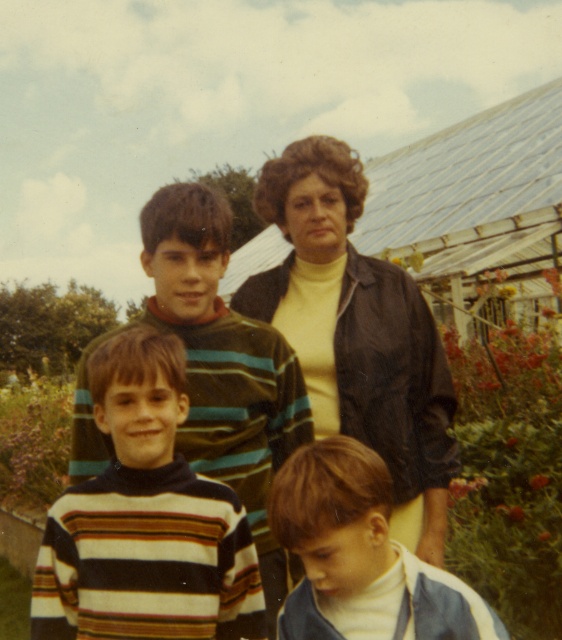
Which is in front, point (347, 337) or point (446, 600)?

Point (446, 600) is in front.

Find the location of a particular element. matte black jacket at center is located at coordinates (357, 333).

Which is in front, point (184, 257) or point (98, 632)?

Positioned in front is point (98, 632).

The image size is (562, 640). What are the coordinates of `striped wool sweater at center` in the screenshot? It's located at (301, 349).

You are a GUI agent. You are given a task and a screenshot of the screen. Output one action in this format:
    pyautogui.click(x=<x>, y=<y>)
    Task: Click on the striped wool sweater at center
    This screenshot has height=640, width=562.
    Given the screenshot: What is the action you would take?
    pyautogui.click(x=301, y=349)

Who is more forward, (314, 371) or (284, 150)?

Point (314, 371) is more forward.

Does point (285, 332) come farther from viewer compared to point (373, 353)?

Yes, it is.

Find the location of `striped wool sweater at center`. striped wool sweater at center is located at coordinates (301, 349).